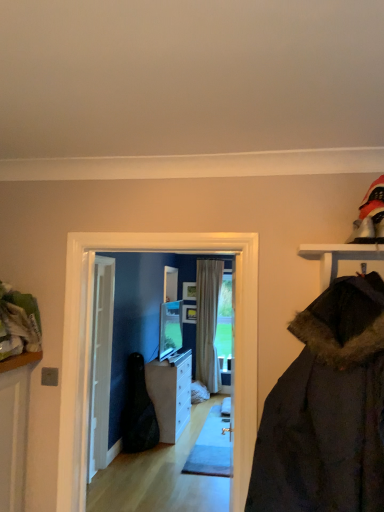
Question: From the image's perspective, is white glossy cabinet at center above matte glass screen door at center?

Choices:
 (A) no
 (B) yes

Answer: (A)

Question: From a real-world perspective, is white glossy cabinet at center below matte glass screen door at center?

Choices:
 (A) yes
 (B) no

Answer: (A)

Question: Is white glossy cabinet at center smaller than matte glass screen door at center?

Choices:
 (A) no
 (B) yes

Answer: (A)

Question: Is matte glass screen door at center inside white glossy cabinet at center?

Choices:
 (A) no
 (B) yes

Answer: (A)

Question: Does white glossy cabinet at center appear on the right side of matte glass screen door at center?

Choices:
 (A) no
 (B) yes

Answer: (A)

Question: Is point (125, 428) closer or farther from the camera than point (195, 296)?

Choices:
 (A) closer
 (B) farther

Answer: (A)

Question: Is black leather guitar case at center to the left or to the right of beige fabric curtain at center in the image?

Choices:
 (A) left
 (B) right

Answer: (A)

Question: Is black leather guitar case at center wider or thinner than beige fabric curtain at center?

Choices:
 (A) wide
 (B) thin

Answer: (A)

Question: Which is correct: black leather guitar case at center is inside beige fabric curtain at center, or outside of it?

Choices:
 (A) inside
 (B) outside

Answer: (B)

Question: Based on their positions, is black leather guitar case at center located to the left or right of white glossy cabinet at center?

Choices:
 (A) left
 (B) right

Answer: (A)

Question: Considering the positions of black leather guitar case at center and white glossy cabinet at center in the image, is black leather guitar case at center taller or shorter than white glossy cabinet at center?

Choices:
 (A) short
 (B) tall

Answer: (B)

Question: Would you say black leather guitar case at center is inside or outside white glossy cabinet at center?

Choices:
 (A) outside
 (B) inside

Answer: (A)

Question: In terms of width, does black leather guitar case at center look wider or thinner when compared to white glossy cabinet at center?

Choices:
 (A) thin
 (B) wide

Answer: (A)

Question: Considering the positions of beige fabric curtain at center and matte glass screen door at center in the image, is beige fabric curtain at center taller or shorter than matte glass screen door at center?

Choices:
 (A) tall
 (B) short

Answer: (A)

Question: From a real-world perspective, is beige fabric curtain at center above or below matte glass screen door at center?

Choices:
 (A) above
 (B) below

Answer: (B)